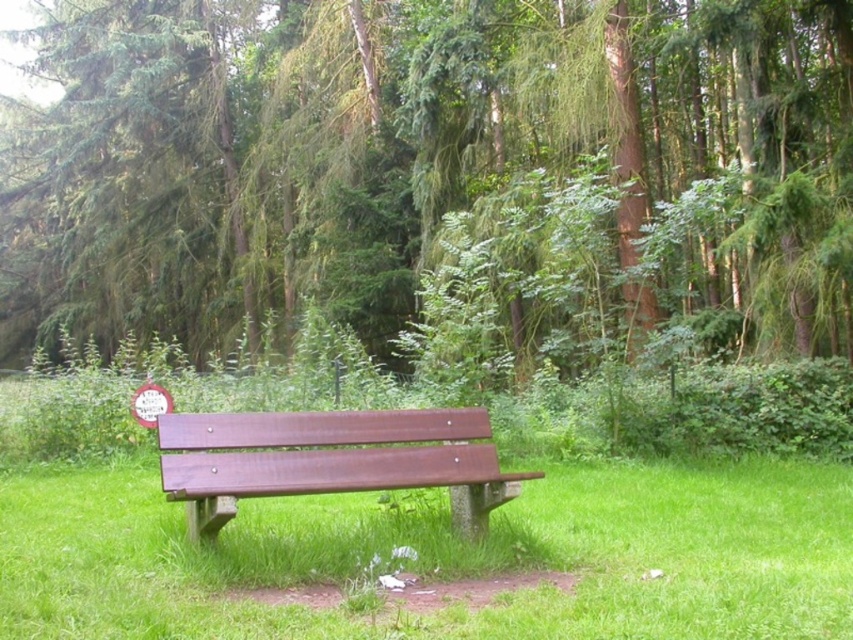
Which of these two, green leafy tree at center or wooden bench at center, stands shorter?

With less height is wooden bench at center.

Does green leafy tree at center appear under wooden bench at center?

Incorrect, green leafy tree at center is not positioned below wooden bench at center.

Which is in front, point (697, 138) or point (416, 426)?

Point (416, 426) is in front.

Identify the location of green leafy tree at center. (403, 148).

Does green leafy tree at center have a lesser width compared to brown wood bench at center?

No, green leafy tree at center is not thinner than brown wood bench at center.

Is point (354, 308) behind point (167, 508)?

That is True.

At what (x,y) coordinates should I click in order to perform the action: click on green leafy tree at center. Please return your answer as a coordinate pair (x, y). This screenshot has width=853, height=640. Looking at the image, I should click on (403, 148).

Is point (65, 608) positioned in front of point (375, 440)?

Yes, point (65, 608) is closer to viewer.

Is brown wood bench at center taller than wooden bench at center?

No, brown wood bench at center is not taller than wooden bench at center.

Between point (610, 493) and point (170, 483), which one is positioned behind?

The point (610, 493) is behind.

Identify the location of brown wood bench at center. This screenshot has width=853, height=640. (444, 556).